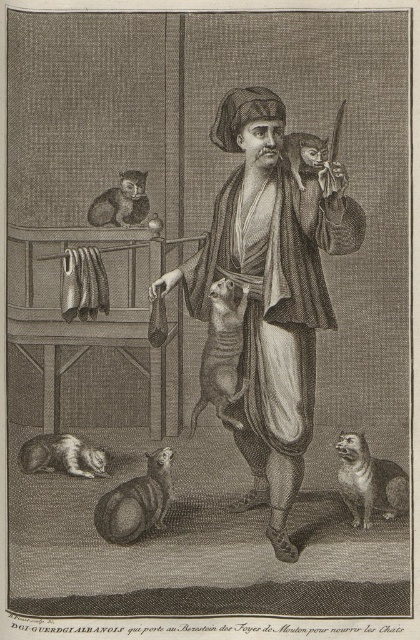
You are a cat owner who wants to place a small toy between the fluffy brown cat at lower right and the fluffy brown cat at upper center. Based on their sizes, which cat should the toy be closer to?

The fluffy brown cat at lower right is taller than the fluffy brown cat at upper center, so the toy should be placed closer to the taller cat to ensure visibility and accessibility.